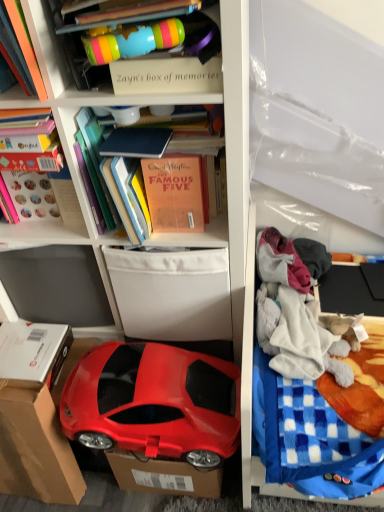
Question: Should I look upward or downward to see matte orange book at upper left, positioned as the 2th book in left-to-right order?

Choices:
 (A) up
 (B) down

Answer: (A)

Question: Is cardboard at lower left positioned far away from matte plastic toy car at lower left?

Choices:
 (A) no
 (B) yes

Answer: (A)

Question: Can we say cardboard at lower left lies outside matte plastic toy car at lower left?

Choices:
 (A) yes
 (B) no

Answer: (A)

Question: From the image's perspective, would you say cardboard at lower left is shown under matte plastic toy car at lower left?

Choices:
 (A) yes
 (B) no

Answer: (A)

Question: Does cardboard at lower left have a larger size compared to matte plastic toy car at lower left?

Choices:
 (A) yes
 (B) no

Answer: (B)

Question: Is cardboard at lower left positioned with its back to matte plastic toy car at lower left?

Choices:
 (A) yes
 (B) no

Answer: (A)

Question: Can matte plastic toy car at lower left be found inside cardboard at lower left?

Choices:
 (A) no
 (B) yes

Answer: (A)

Question: Is matte plastic toy car at lower left to the right of cardboard at lower left from the viewer's perspective?

Choices:
 (A) no
 (B) yes

Answer: (B)

Question: Is matte plastic toy car at lower left positioned in front of cardboard at lower left?

Choices:
 (A) yes
 (B) no

Answer: (A)

Question: Does matte plastic toy car at lower left turn towards cardboard at lower left?

Choices:
 (A) no
 (B) yes

Answer: (B)

Question: Is matte plastic toy car at lower left at the left side of cardboard at lower left?

Choices:
 (A) yes
 (B) no

Answer: (B)

Question: From the image's perspective, would you say matte plastic toy car at lower left is positioned over cardboard at lower left?

Choices:
 (A) yes
 (B) no

Answer: (A)

Question: From the image's perspective, does matte plastic toy car at lower left appear lower than cardboard at lower left?

Choices:
 (A) yes
 (B) no

Answer: (B)

Question: Is blue checkered blanket at right located within cardboard at lower left?

Choices:
 (A) no
 (B) yes

Answer: (A)